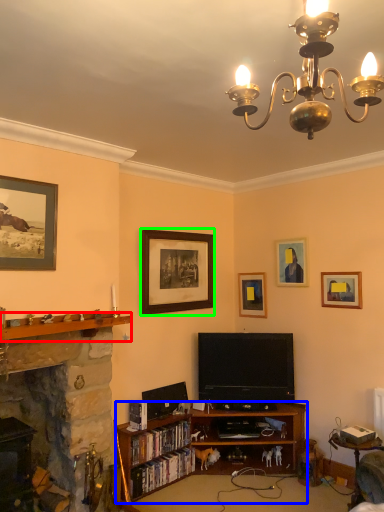
Question: Which object is positioned closest to shelf (highlighted by a red box)? Select from bookcase (highlighted by a blue box) and picture frame (highlighted by a green box).

Choices:
 (A) bookcase
 (B) picture frame

Answer: (B)